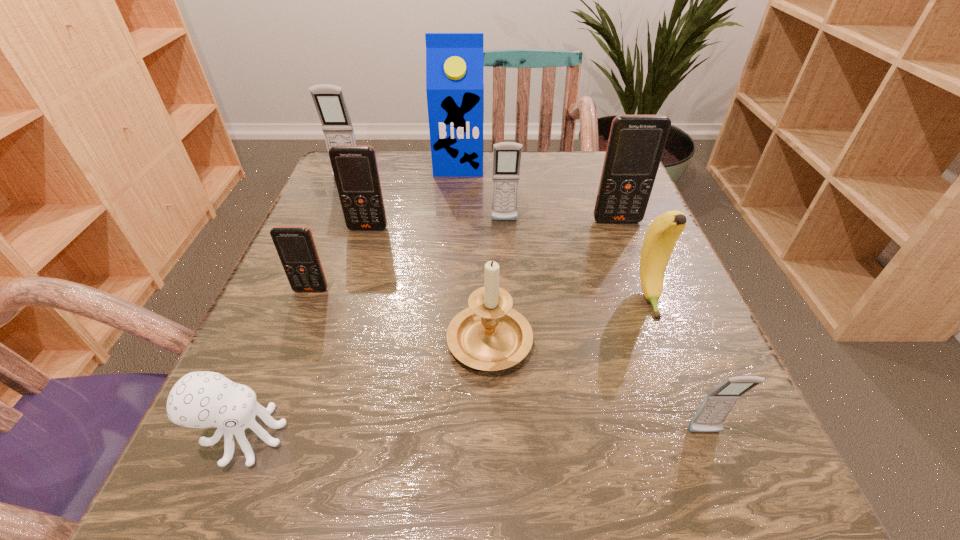
Locate an element on the screen. The image size is (960, 540). the farthest object is located at coordinates (454, 61).

Where is `blue carton`? blue carton is located at coordinates (454, 61).

Where is `the ninth nearest object`? the ninth nearest object is located at coordinates pos(329,100).

You are a GUI agent. You are given a task and a screenshot of the screen. Output one action in this format:
    pyautogui.click(x=<x>, y=<y>)
    Task: Click on the biggest gray cellular telephone
    
    Given the screenshot: What is the action you would take?
    pyautogui.click(x=329, y=100)

Where is `the farthest orange cellular telephone`? the farthest orange cellular telephone is located at coordinates (636, 143).

The image size is (960, 540). I want to click on the biggest orange cellular telephone, so click(636, 143).

The image size is (960, 540). What are the coordinates of `the second farthest gray cellular telephone` in the screenshot? It's located at (506, 155).

Find the location of a particular element. the fourth cellular telephone from left to right is located at coordinates (506, 155).

Identify the location of the third nearest cellular telephone. This screenshot has height=540, width=960. (355, 169).

Identify the location of the sixth nearest object. (355, 169).